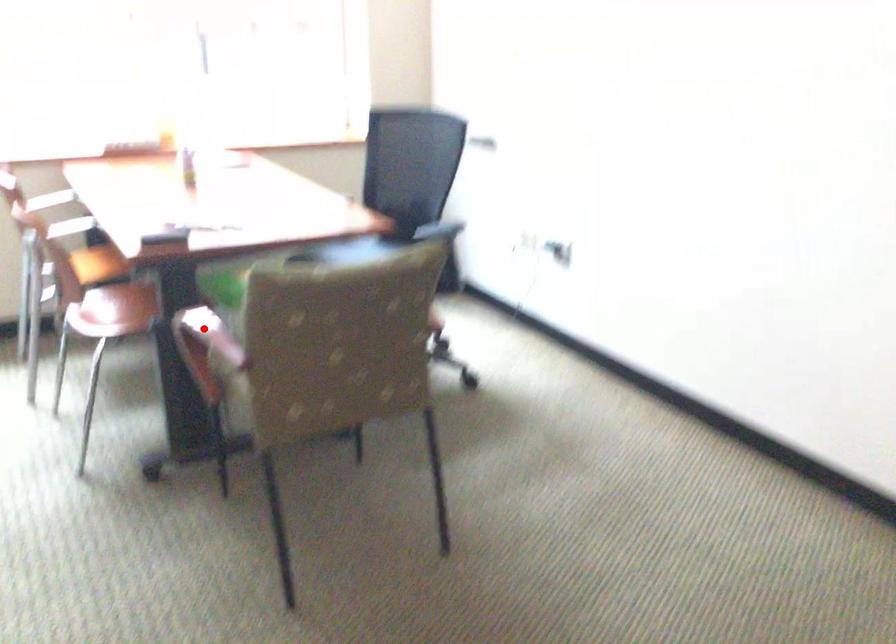
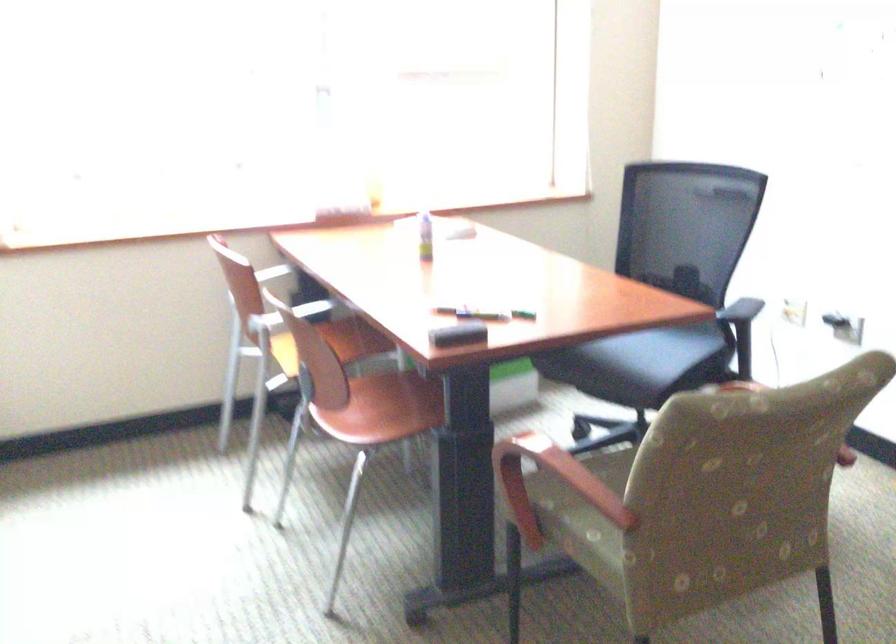
Question: I am providing you with two images of the same scene from different viewpoints. Given a red point in image1, look at the same physical point in image2. Is it:

Choices:
 (A) Closer to the viewpoint
 (B) Farther from the viewpoint

Answer: (A)